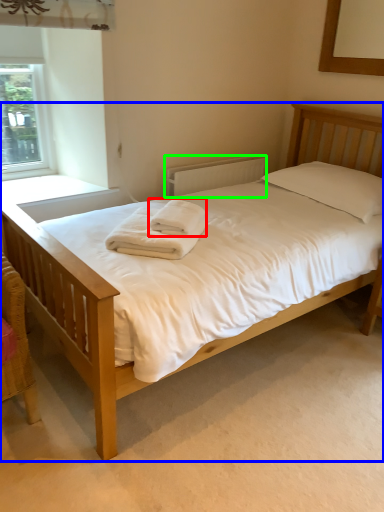
Question: Which is nearer to the bath towel (highlighted by a red box)? bed (highlighted by a blue box) or radiator (highlighted by a green box).

Choices:
 (A) bed
 (B) radiator

Answer: (A)